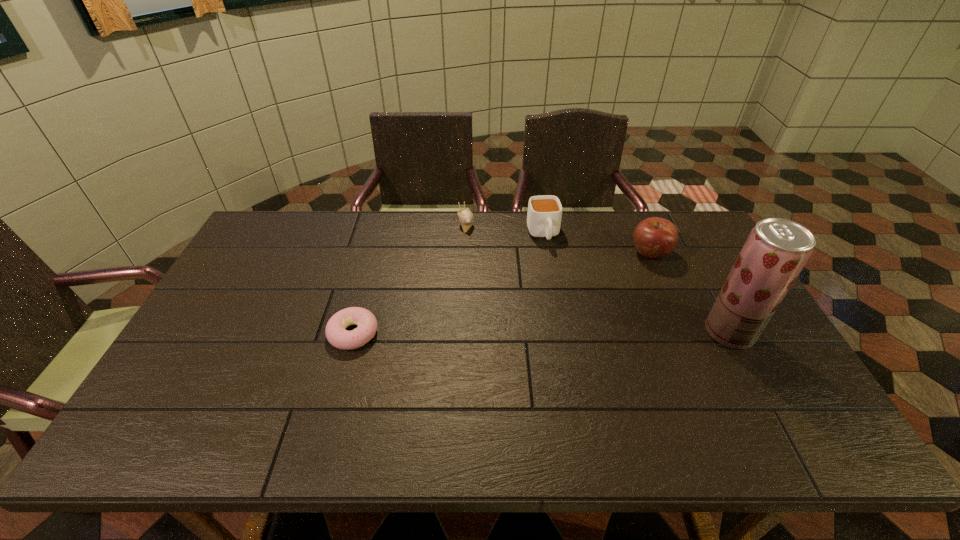
Identify the location of free point located on the side with the handle of the cup. The height and width of the screenshot is (540, 960). (554, 271).

What are the coordinates of `free spot located 0.260m on the side with the handle of the cup` in the screenshot? It's located at (564, 306).

Find the location of a particular element. This screenshot has height=540, width=960. blank area located on the side of the apple with the unique marking is located at coordinates (621, 279).

Find the location of `free spot located on the side of the apple with the unique marking`. free spot located on the side of the apple with the unique marking is located at coordinates (628, 273).

At what (x,y) coordinates should I click in order to perform the action: click on vacant space located 0.220m on the side of the apple with the unique marking. Please return your answer as a coordinate pair (x, y). Looking at the image, I should click on (602, 297).

At what (x,y) coordinates should I click in order to perform the action: click on vacant region located on the shell of the second object from left to right. Please return your answer as a coordinate pair (x, y). The image size is (960, 540). Looking at the image, I should click on (477, 260).

Image resolution: width=960 pixels, height=540 pixels. I want to click on vacant space located 0.330m on the shell of the second object from left to right, so click(491, 298).

Find the location of `vacant space located on the shell of the second object from left to right`. vacant space located on the shell of the second object from left to right is located at coordinates (494, 310).

Find the location of a particular element. Image resolution: width=960 pixels, height=540 pixels. cup that is at the far edge is located at coordinates coord(544,215).

The height and width of the screenshot is (540, 960). Find the location of `apple at the far edge`. apple at the far edge is located at coordinates click(654, 237).